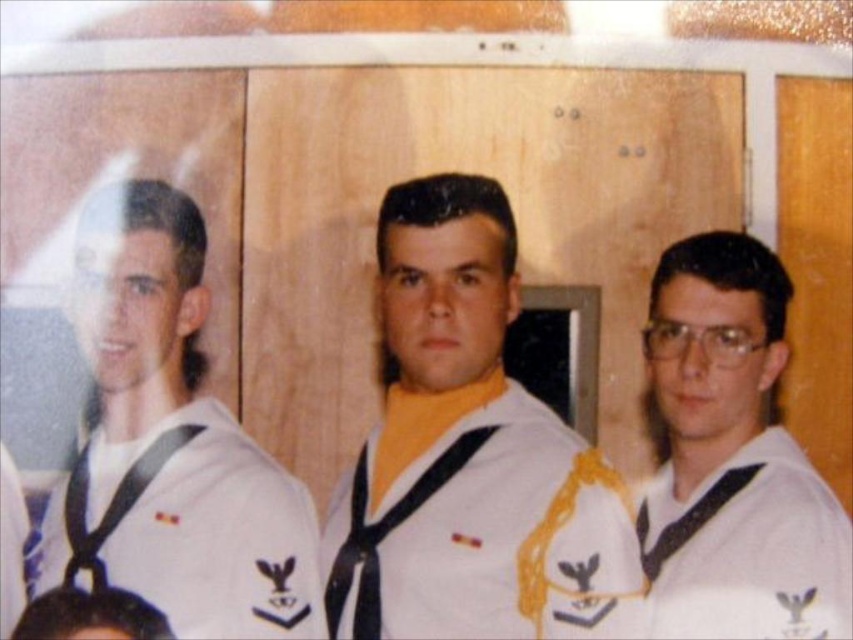
Question: Is white matte uniform at left to the left of white matte sailor uniform at right from the viewer's perspective?

Choices:
 (A) no
 (B) yes

Answer: (B)

Question: Which point is farther to the camera?

Choices:
 (A) white matte uniform at center
 (B) white matte sailor uniform at right

Answer: (B)

Question: Among these points, which one is nearest to the camera?

Choices:
 (A) (538, 570)
 (B) (672, 278)

Answer: (A)

Question: Which of the following is the closest to the observer?

Choices:
 (A) white matte uniform at center
 (B) white matte sailor uniform at right
 (C) white matte uniform at left

Answer: (A)

Question: Is white matte uniform at center wider than white matte sailor uniform at right?

Choices:
 (A) no
 (B) yes

Answer: (B)

Question: Does white matte uniform at center have a smaller size compared to white matte uniform at left?

Choices:
 (A) yes
 (B) no

Answer: (B)